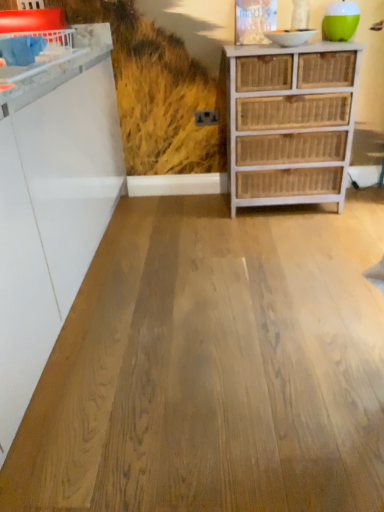
What do you see at coordinates (214, 367) in the screenshot? I see `natural wood floor at center` at bounding box center [214, 367].

Measure the distance between white wicker chest of drawers at right and camera.

They are 1.98 meters apart.

At what (x,y) coordinates should I click in order to perform the action: click on white glossy counter at upper left. Please return your answer as a coordinate pair (x, y). Looking at the image, I should click on (54, 68).

You are a GUI agent. You are given a task and a screenshot of the screen. Output one action in this format:
    pyautogui.click(x=<x>, y=<y>)
    Task: Click on the natural wood floor at center
    
    Given the screenshot: What is the action you would take?
    pyautogui.click(x=214, y=367)

Is white wicker chest of drawers at right bigger or smaller than white glossy counter at upper left?

In the image, white wicker chest of drawers at right appears to be larger than white glossy counter at upper left.

Between white wicker chest of drawers at right and white glossy counter at upper left, which one appears on the right side from the viewer's perspective?

white wicker chest of drawers at right.

How much distance is there between white wicker chest of drawers at right and white glossy counter at upper left?

white wicker chest of drawers at right is 39.22 inches away from white glossy counter at upper left.

What's the angular difference between white wicker chest of drawers at right and white glossy counter at upper left's facing directions?

white wicker chest of drawers at right and white glossy counter at upper left are facing 89.6 degrees away from each other.

Is natural wood floor at center closer to the viewer compared to white glossy counter at upper left?

That is True.

Is natural wood floor at center oriented away from white glossy counter at upper left?

No, natural wood floor at center's orientation is not away from white glossy counter at upper left.

Considering the relative positions of natural wood floor at center and white glossy counter at upper left in the image provided, is natural wood floor at center to the left or to the right of white glossy counter at upper left?

From the image, it's evident that natural wood floor at center is to the right of white glossy counter at upper left.

Based on the photo, from the image's perspective, which object appears higher, natural wood floor at center or white glossy counter at upper left?

white glossy counter at upper left appears higher in the image.

Is white glossy counter at upper left to the left or to the right of natural wood floor at center in the image?

In the image, white glossy counter at upper left appears on the left side of natural wood floor at center.

Can you tell me how much white glossy counter at upper left and natural wood floor at center differ in facing direction?

90.2 degrees.

Between white glossy counter at upper left and natural wood floor at center, which one is positioned in front?

natural wood floor at center.

Looking at this image, from the image's perspective, is white glossy counter at upper left positioned above or below natural wood floor at center?

white glossy counter at upper left is situated higher than natural wood floor at center in the image.

Considering the relative sizes of white wicker chest of drawers at right and natural wood floor at center in the image provided, is white wicker chest of drawers at right shorter than natural wood floor at center?

No.

Which object is further away from the camera taking this photo, white wicker chest of drawers at right or natural wood floor at center?

white wicker chest of drawers at right.

Considering the relative positions of white wicker chest of drawers at right and natural wood floor at center in the image provided, is white wicker chest of drawers at right to the left of natural wood floor at center from the viewer's perspective?

In fact, white wicker chest of drawers at right is to the right of natural wood floor at center.

Measure the distance between white wicker chest of drawers at right and natural wood floor at center.

A distance of 31.05 inches exists between white wicker chest of drawers at right and natural wood floor at center.

Is white glossy counter at upper left closer to the viewer compared to white wicker chest of drawers at right?

That is True.

From a real-world perspective, is white glossy counter at upper left on white wicker chest of drawers at right?

Yes.

Is white glossy counter at upper left to the left of white wicker chest of drawers at right from the viewer's perspective?

Yes.

Which object is further away from the camera taking this photo, natural wood floor at center or white wicker chest of drawers at right?

white wicker chest of drawers at right is further from the camera.

Who is smaller, natural wood floor at center or white wicker chest of drawers at right?

Smaller between the two is natural wood floor at center.

From the image's perspective, is natural wood floor at center over white wicker chest of drawers at right?

No, from the image's perspective, natural wood floor at center is not above white wicker chest of drawers at right.

From a real-world perspective, is natural wood floor at center positioned above or below white wicker chest of drawers at right?

natural wood floor at center is below white wicker chest of drawers at right.

I want to click on the chest of drawers located below the white glossy counter at upper left (from the image's perspective), so click(289, 123).

Where is `counter lying on the left of natural wood floor at center`? counter lying on the left of natural wood floor at center is located at coordinates (54, 68).

Which object lies nearer to the anchor point natural wood floor at center, white wicker chest of drawers at right or white glossy counter at upper left?

white wicker chest of drawers at right is positioned closer to the anchor natural wood floor at center.

Based on their spatial positions, is natural wood floor at center or white wicker chest of drawers at right closer to white glossy counter at upper left?

white wicker chest of drawers at right.

Considering their positions, is white glossy counter at upper left positioned further to natural wood floor at center than white wicker chest of drawers at right?

The object further to natural wood floor at center is white glossy counter at upper left.

When comparing their distances from white wicker chest of drawers at right, does natural wood floor at center or white glossy counter at upper left seem closer?

natural wood floor at center is positioned closer to the anchor white wicker chest of drawers at right.

Based on their spatial positions, is white wicker chest of drawers at right or natural wood floor at center closer to white glossy counter at upper left?

The object closer to white glossy counter at upper left is white wicker chest of drawers at right.

Looking at this image, considering their positions, is white glossy counter at upper left positioned further to white wicker chest of drawers at right than natural wood floor at center?

The object further to white wicker chest of drawers at right is white glossy counter at upper left.

Identify the location of plywood located between white glossy counter at upper left and white wicker chest of drawers at right in the left-right direction. This screenshot has height=512, width=384. (214, 367).